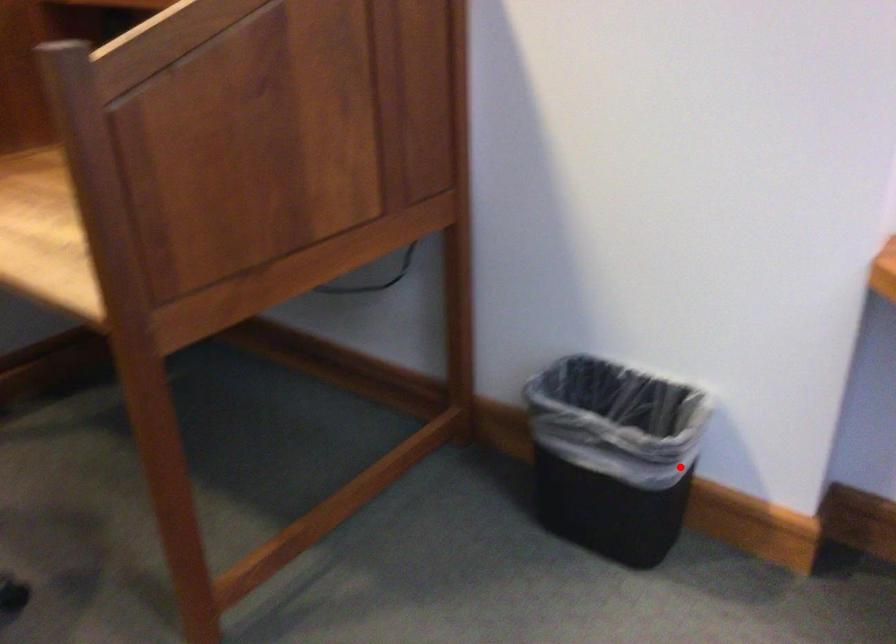
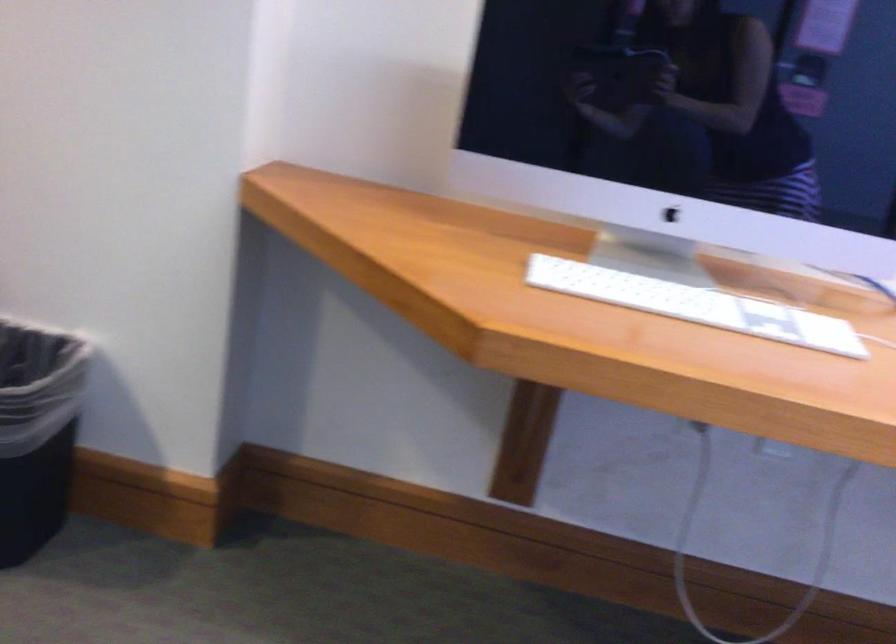
Question: A red point is marked in image1. In image2, is the corresponding 3D point closer to the camera or farther? Reply with the corresponding letter.

Choices:
 (A) The corresponding 3D point is closer.
 (B) The corresponding 3D point is farther.

Answer: (A)